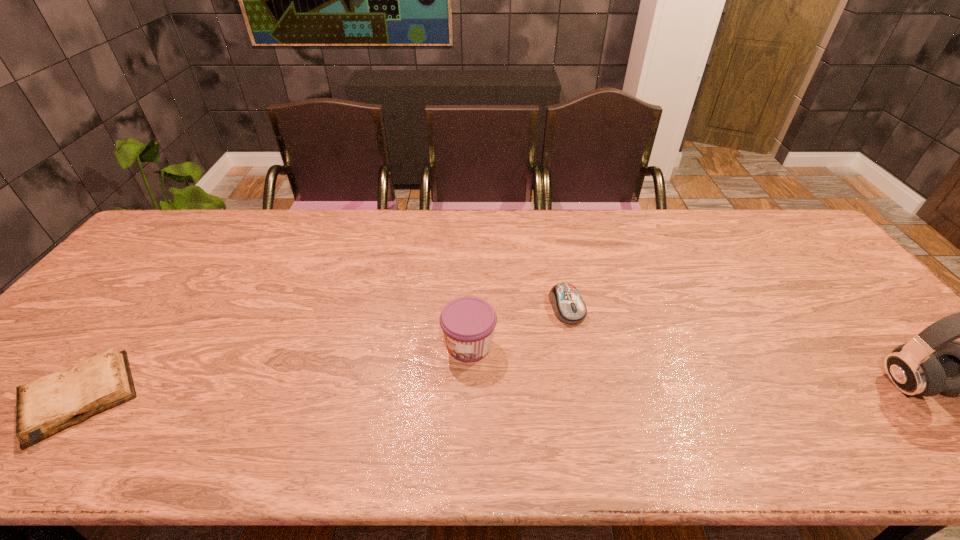
Locate an element on the screen. The height and width of the screenshot is (540, 960). free space in the image that satisfies the following two spatial constraints: 1. on the back side of the computer mouse; 2. on the left side of the third object from right to left is located at coordinates (469, 307).